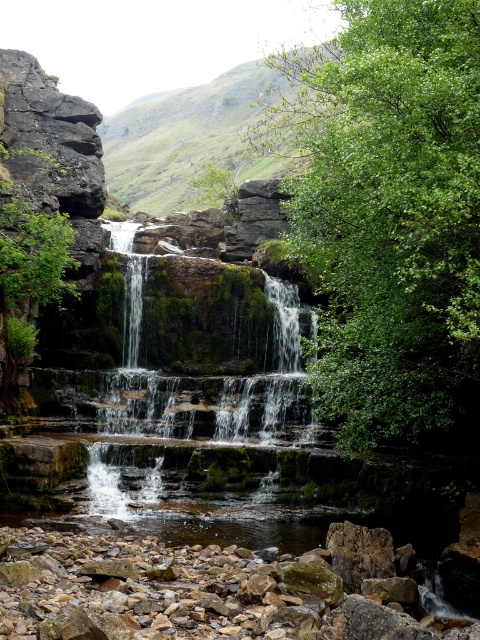
Question: Is green leafy tree at center wider than green mossy rock at upper center?

Choices:
 (A) yes
 (B) no

Answer: (B)

Question: Which object is farther from the camera taking this photo?

Choices:
 (A) green mossy rock at upper center
 (B) green leafy tree at center

Answer: (A)

Question: Is green leafy tree at center to the right of green mossy rock at upper center from the viewer's perspective?

Choices:
 (A) yes
 (B) no

Answer: (A)

Question: Which point is farther to the camera?

Choices:
 (A) (422, 392)
 (B) (252, 108)

Answer: (B)

Question: Observing the image, what is the correct spatial positioning of green leafy tree at center in reference to green mossy rock at upper center?

Choices:
 (A) below
 (B) above

Answer: (A)